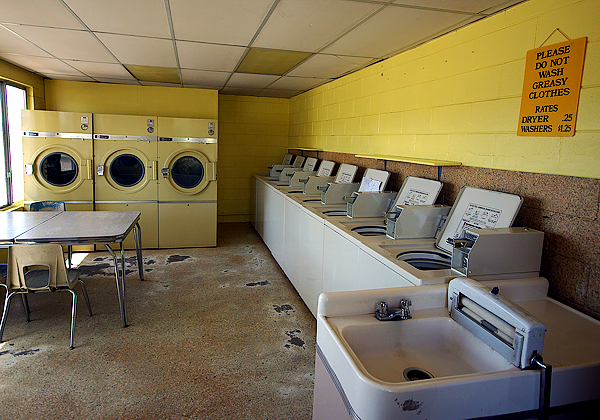
Where is `dryer`? dryer is located at coordinates (127, 127).